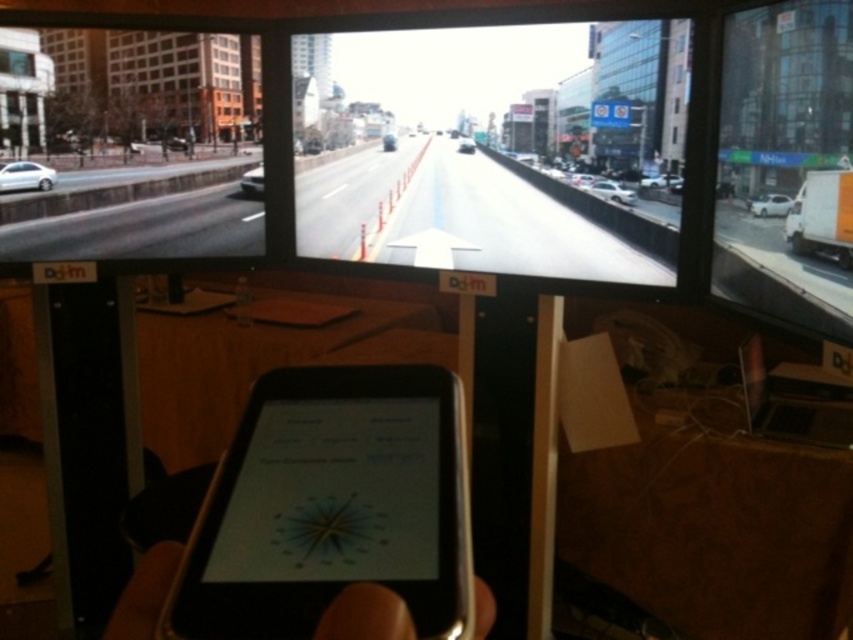
Question: Is matte black monitor at center below shiny black car at center?

Choices:
 (A) yes
 (B) no

Answer: (B)

Question: Which point appears closest to the camera in this image?

Choices:
 (A) (775, 204)
 (B) (209, 566)

Answer: (B)

Question: Does matte black monitor at center have a lesser width compared to white glossy car at center?

Choices:
 (A) no
 (B) yes

Answer: (A)

Question: Which of these objects is positioned closest to the black glossy tablet at center?

Choices:
 (A) white glossy car at center
 (B) white matte car at left
 (C) metallic silver car at center

Answer: (A)

Question: Where is white matte car at left located in relation to white matte van at right in the image?

Choices:
 (A) below
 (B) above

Answer: (B)

Question: Among these objects, which one is nearest to the camera?

Choices:
 (A) white matte car at center
 (B) shiny black car at center
 (C) matte black monitor at left
 (D) metallic silver car at center

Answer: (A)